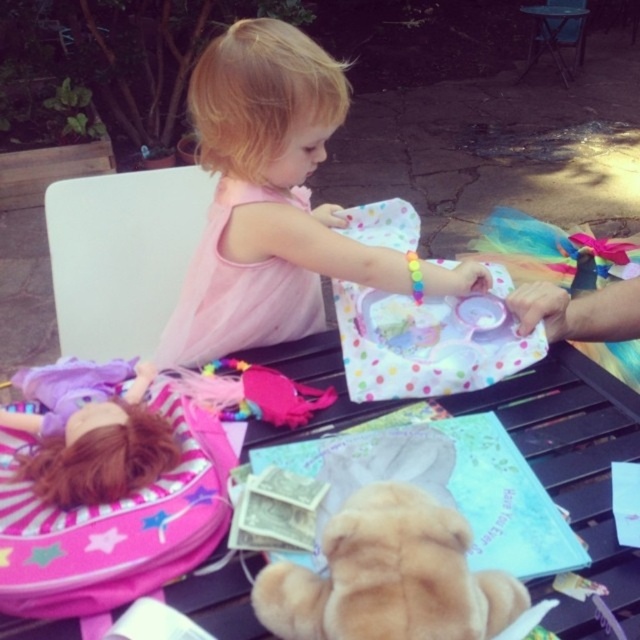
You are a photographer setting up for a family photo. You need to position the black plastic table at center so that it is visible in the background behind the pink fabric dress at center. Is the current arrangement already suitable for this requirement?

Yes, the current arrangement is suitable because the black plastic table at center is already positioned behind the pink fabric dress at center, making it visible in the background.

You are a photographer setting up for a photoshoot at the gathering. You need to ensure the pink fabric dress at center and the fuzzy beige teddy bear at lower center are both visible in the frame. Based on their positions, which object is closer to the left edge of the photo?

The pink fabric dress at center is positioned on the left side of the fuzzy beige teddy bear at lower center, so the pink fabric dress at center is closer to the left edge of the photo.